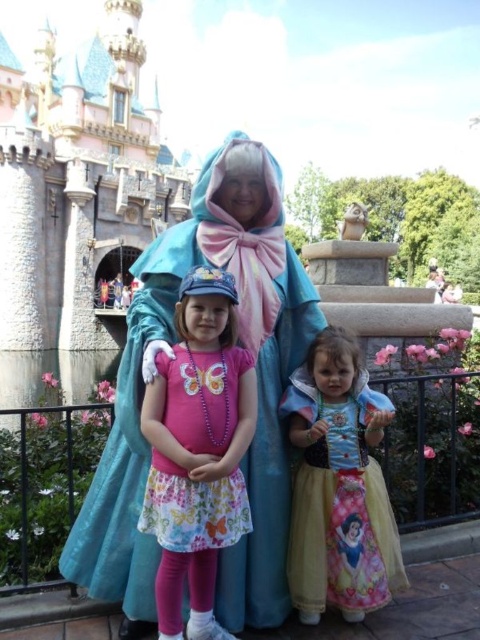
You are a photographer at Disneyland and need to adjust the lighting for a group photo. You notice the turquoise satin cape at center and the pink fabric dress at center. Which object is positioned more to the right?

The turquoise satin cape at center is positioned more to the right than the pink fabric dress at center.

You are standing at the point labeled as point (257,394) in the image. What object are you touching?

You are touching the turquoise satin cape at center.

Consider the image. You are standing in front of the stone castle at center and want to take a photo that includes the entire structure without any part being cut off. Based on the distance provided, what is the minimum focal length lens you should use if your camera has a sensor size of 24mm x 36mm and the castle is 56.16 meters away?

The stone castle at center is 56.16 meters from the camera. To capture the entire castle without cropping, the minimum focal length can be calculated using the formula for field of view. However, without knowing the castle dimensions, an exact calculation isn